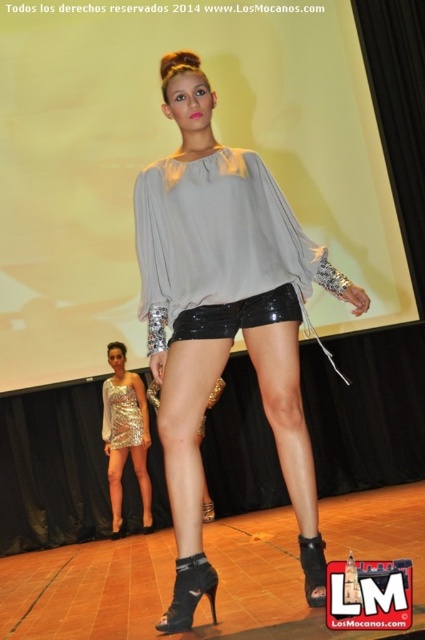
Can you confirm if black leather boot at lower center is positioned above black patent leather boot at center?

No.

Is black leather boot at lower center shorter than black patent leather boot at center?

No.

In order to click on black leather boot at lower center in this screenshot , I will do `click(189, 593)`.

In order to click on black leather boot at lower center in this screenshot , I will do `click(189, 593)`.

Which of these two, black shiny shorts at center or shiny sequined dress at center, stands shorter?

Standing shorter between the two is black shiny shorts at center.

Between point (178, 323) and point (110, 387), which one is positioned in front?

Point (178, 323)

Locate an element on the screen. black shiny shorts at center is located at coordinates (237, 316).

Between black leather boot at lower center and shiny sequined dress at center, which one has more height?

shiny sequined dress at center

Does black leather boot at lower center have a larger size compared to shiny sequined dress at center?

No, black leather boot at lower center is not bigger than shiny sequined dress at center.

Between point (214, 573) and point (139, 442), which one is positioned in front?

Point (214, 573) is more forward.

You are a GUI agent. You are given a task and a screenshot of the screen. Output one action in this format:
    pyautogui.click(x=<x>, y=<y>)
    Task: Click on the black leather boot at lower center
    The height and width of the screenshot is (640, 425).
    Given the screenshot: What is the action you would take?
    pyautogui.click(x=189, y=593)